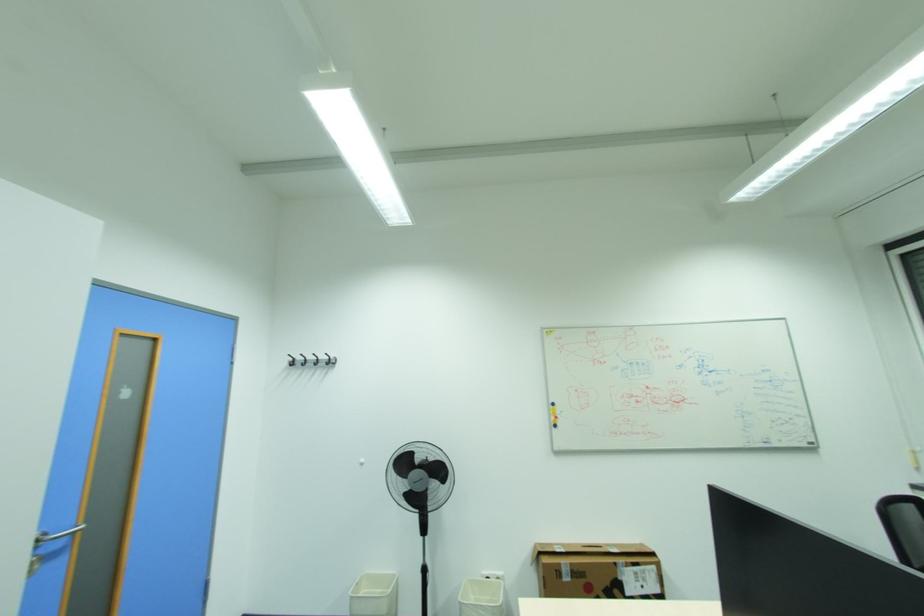
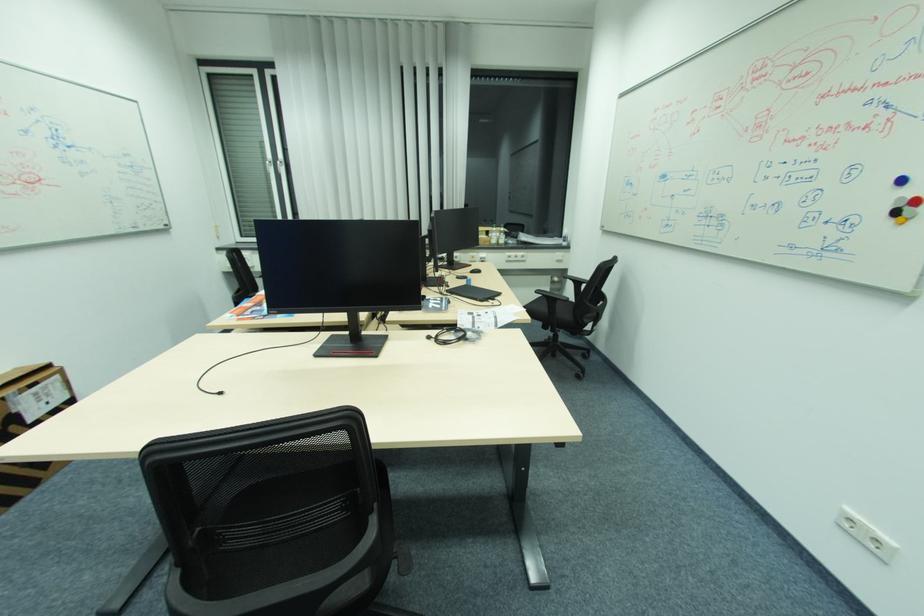
In the second image, find the point that corresponds to pixel 619 564 in the first image.

(7, 399)